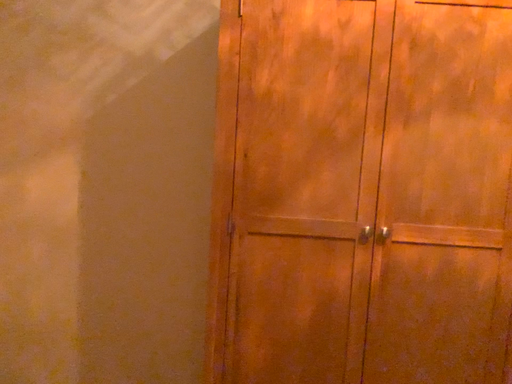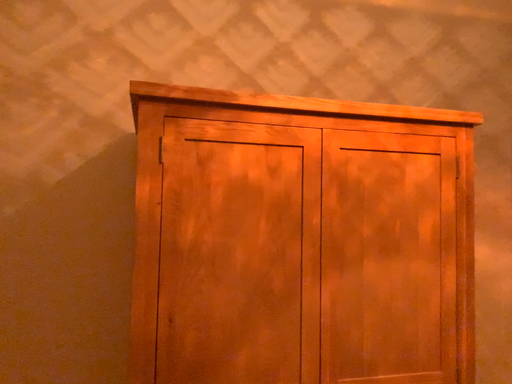
Question: How did the camera likely rotate when shooting the video?

Choices:
 (A) rotated downward
 (B) rotated upward

Answer: (B)